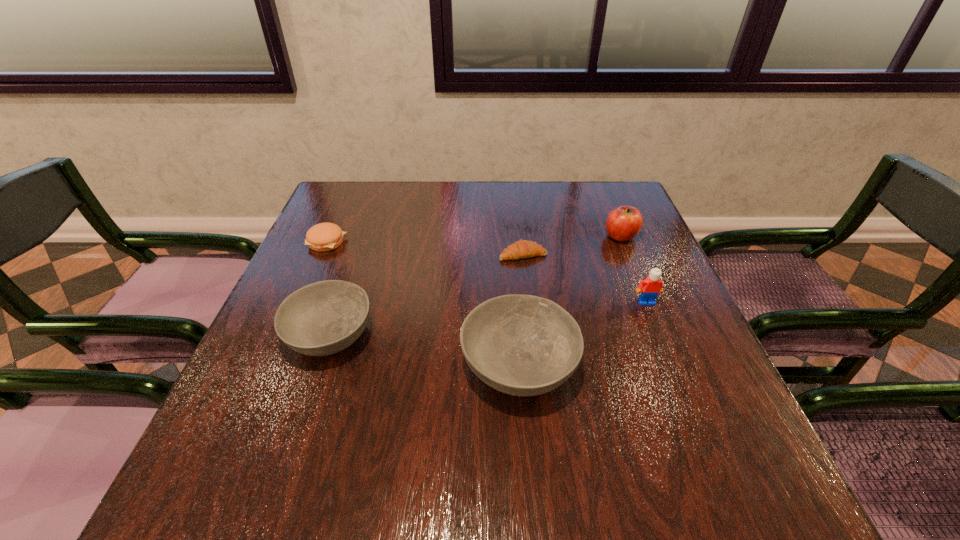
Locate an element on the screen. empty space between the Lego and the crescent roll is located at coordinates (585, 278).

The height and width of the screenshot is (540, 960). I want to click on unoccupied area between the shortest object and the Lego, so click(x=585, y=278).

Find the location of a particular element. The width and height of the screenshot is (960, 540). free space that is in between the crescent roll and the fifth tallest object is located at coordinates (425, 248).

This screenshot has height=540, width=960. In order to click on the fifth closest object relative to the shorter bowl in this screenshot , I will do `click(623, 223)`.

Locate an element on the screen. This screenshot has height=540, width=960. object that ranks as the third closest to the shortest object is located at coordinates (651, 286).

Find the location of `vacant point that satisfies the following two spatial constraints: 1. on the back side of the taller bowl; 2. on the right side of the shortest object`. vacant point that satisfies the following two spatial constraints: 1. on the back side of the taller bowl; 2. on the right side of the shortest object is located at coordinates (510, 254).